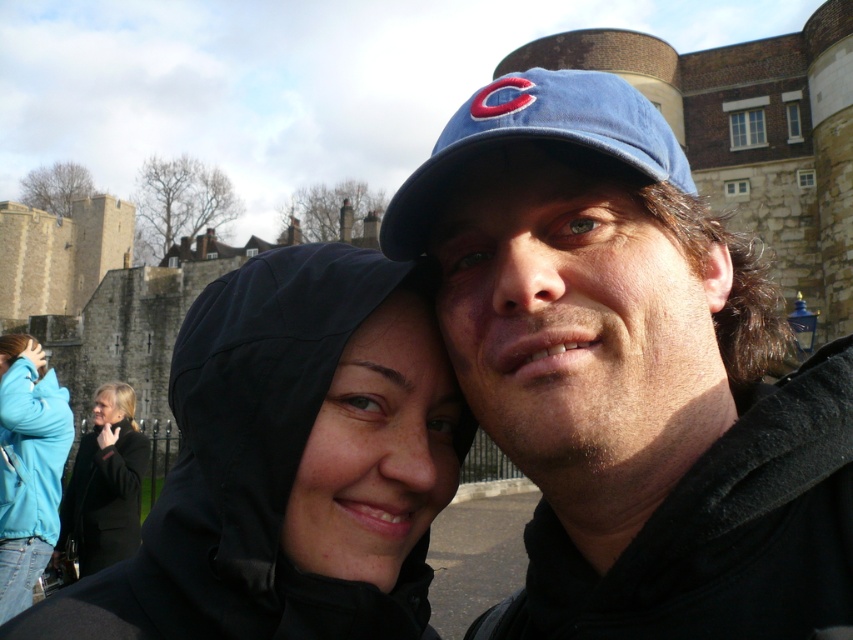
Is point (439, 204) behind point (114, 508)?

No, it is in front of (114, 508).

This screenshot has width=853, height=640. Find the location of `blue fabric cap at center`. blue fabric cap at center is located at coordinates pos(532,180).

Who is more distant from viewer, (x=349, y=403) or (x=672, y=154)?

The point (x=349, y=403) is behind.

Does black matte hood at center have a lesser width compared to blue fabric baseball cap at center?

No.

Is point (219, 538) closer to viewer compared to point (587, 122)?

No, (219, 538) is behind (587, 122).

Identify the location of black matte hood at center. This screenshot has width=853, height=640. coord(291,461).

Who is taller, matte blue cap at center or blue fabric baseball cap at center?

matte blue cap at center is taller.

From the picture: Can you confirm if matte blue cap at center is positioned above blue fabric baseball cap at center?

No, matte blue cap at center is not above blue fabric baseball cap at center.

Does point (618, 381) lie in front of point (430, 196)?

Yes, point (618, 381) is in front of point (430, 196).

You are a GUI agent. You are given a task and a screenshot of the screen. Output one action in this format:
    pyautogui.click(x=<x>, y=<y>)
    Task: Click on the matte blue cap at center
    This screenshot has width=853, height=640.
    Given the screenshot: What is the action you would take?
    pyautogui.click(x=579, y=330)